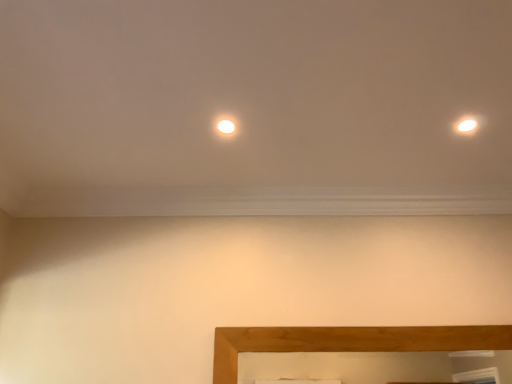
Find the location of a particular element. matte white light at center is located at coordinates (226, 126).

Find the location of a particular element. wooden picture frame at lower center is located at coordinates (349, 341).

Is white glossy light at upper right directly adjacent to wooden picture frame at lower center?

There is a gap between white glossy light at upper right and wooden picture frame at lower center.

What's the angular difference between white glossy light at upper right and wooden picture frame at lower center's facing directions?

The facing directions of white glossy light at upper right and wooden picture frame at lower center are 0.00225 degrees apart.

In terms of width, does white glossy light at upper right look wider or thinner when compared to wooden picture frame at lower center?

Considering their sizes, white glossy light at upper right looks broader than wooden picture frame at lower center.

Who is bigger, white glossy light at upper right or wooden picture frame at lower center?

Bigger between the two is wooden picture frame at lower center.

Is wooden picture frame at lower center oriented towards white glossy light at upper right?

No, wooden picture frame at lower center is not oriented towards white glossy light at upper right.

Considering the relative positions of wooden picture frame at lower center and white glossy light at upper right in the image provided, is wooden picture frame at lower center to the right of white glossy light at upper right from the viewer's perspective?

No, wooden picture frame at lower center is not to the right of white glossy light at upper right.

From the image's perspective, is wooden picture frame at lower center on top of white glossy light at upper right?

Incorrect, from the image's perspective, wooden picture frame at lower center is lower than white glossy light at upper right.

From the picture: Are white glossy light at upper right and matte white light at center located far from each other?

No, white glossy light at upper right is not far away from matte white light at center.

From the image's perspective, which object appears higher, white glossy light at upper right or matte white light at center?

matte white light at center is shown above in the image.

Between white glossy light at upper right and matte white light at center, which one has less height?

With less height is matte white light at center.

Between white glossy light at upper right and matte white light at center, which one appears on the right side from the viewer's perspective?

From the viewer's perspective, white glossy light at upper right appears more on the right side.

From a real-world perspective, which is physically below, matte white light at center or wooden picture frame at lower center?

wooden picture frame at lower center, from a real-world perspective.

Between matte white light at center and wooden picture frame at lower center, which one has smaller width?

wooden picture frame at lower center.

Is the depth of matte white light at center greater than that of wooden picture frame at lower center?

No, the depth of matte white light at center is less than that of wooden picture frame at lower center.

Is wooden picture frame at lower center turned away from matte white light at center?

→ wooden picture frame at lower center is not turned away from matte white light at center.

From the image's perspective, relative to matte white light at center, is wooden picture frame at lower center above or below?

From the image's perspective, wooden picture frame at lower center appears below matte white light at center.

At what (x,y) coordinates should I click in order to perform the action: click on glow that is on the left side of wooden picture frame at lower center. Please return your answer as a coordinate pair (x, y). Looking at the image, I should click on (226, 126).

Which is more to the left, wooden picture frame at lower center or matte white light at center?

matte white light at center is more to the left.

Which of these two, matte white light at center or white glossy light at upper right, is smaller?

matte white light at center.

In the scene shown: Which of these two, matte white light at center or white glossy light at upper right, is thinner?

With smaller width is white glossy light at upper right.

Consider the image. From their relative heights in the image, would you say matte white light at center is taller or shorter than white glossy light at upper right?

Clearly, matte white light at center is shorter compared to white glossy light at upper right.

Where is `picture frame behind the white glossy light at upper right`? The image size is (512, 384). picture frame behind the white glossy light at upper right is located at coordinates (349, 341).

In order to click on light in front of the wooden picture frame at lower center in this screenshot , I will do `click(467, 125)`.

From the image, which object appears to be nearer to white glossy light at upper right, wooden picture frame at lower center or matte white light at center?

matte white light at center.

Based on their spatial positions, is matte white light at center or wooden picture frame at lower center further from white glossy light at upper right?

wooden picture frame at lower center.

When comparing their distances from wooden picture frame at lower center, does matte white light at center or white glossy light at upper right seem closer?

Based on the image, white glossy light at upper right appears to be nearer to wooden picture frame at lower center.

Considering their positions, is white glossy light at upper right positioned closer to wooden picture frame at lower center than matte white light at center?

The object closer to wooden picture frame at lower center is white glossy light at upper right.

Looking at the image, which one is located further to matte white light at center, white glossy light at upper right or wooden picture frame at lower center?

Based on the image, wooden picture frame at lower center appears to be further to matte white light at center.

Consider the image. From the image, which object appears to be nearer to matte white light at center, wooden picture frame at lower center or white glossy light at upper right?

Among the two, white glossy light at upper right is located nearer to matte white light at center.

Find the location of `light between matte white light at center and wooden picture frame at lower center vertically`. light between matte white light at center and wooden picture frame at lower center vertically is located at coordinates (467, 125).